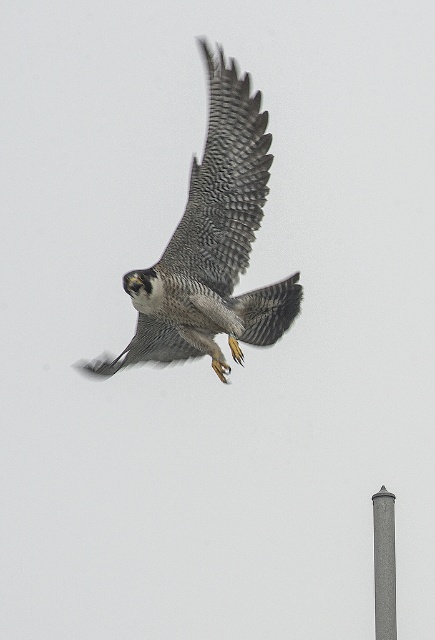
Based on the scene description, where is the gray textured wing at center located in the image?

The gray textured wing at center is located at point (223, 184).